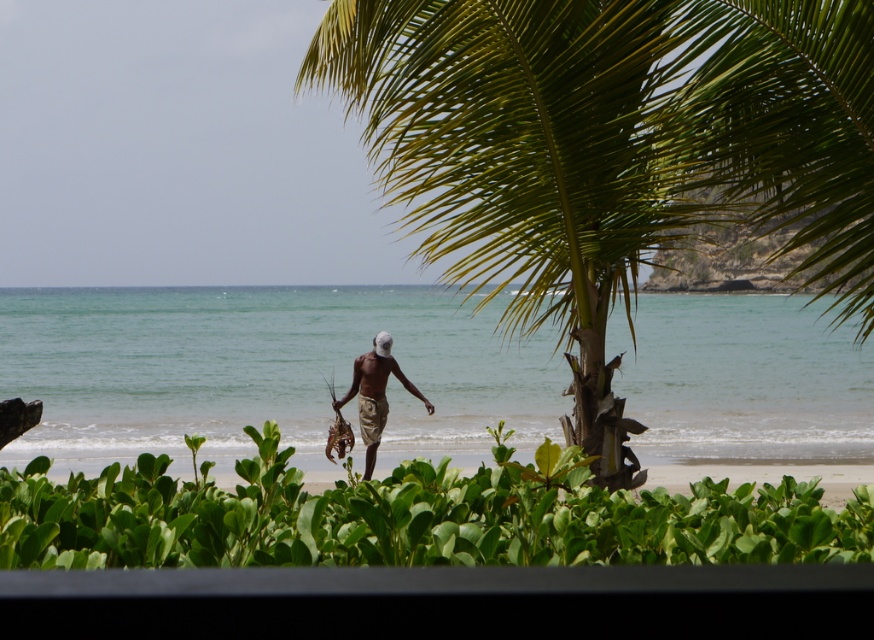
You are standing on the beach and see two points marked in the image. Which point is closer to you, point [438,52] or point [380,387]?

Point [438,52] is closer to the viewer than point [380,387].

You are standing at the point labeled point (531, 548) and want to walk to the point labeled point (364, 390). Which direction should you move to get closer to your destination?

You should move away from the camera because point (364, 390) is further from the camera than point (531, 548).

Looking at this image, you are standing on the beach and want to take a photo of the man walking towards the ocean. Which object, the green leafy palm tree at center or the green leafy shrub at lower center, should you position yourself to the left of to avoid blocking your view?

You should position yourself to the left of the green leafy shrub at lower center. Since the green leafy palm tree at center is to the right of the green leafy shrub at lower center, positioning yourself left of the shrub ensures the palm tree won